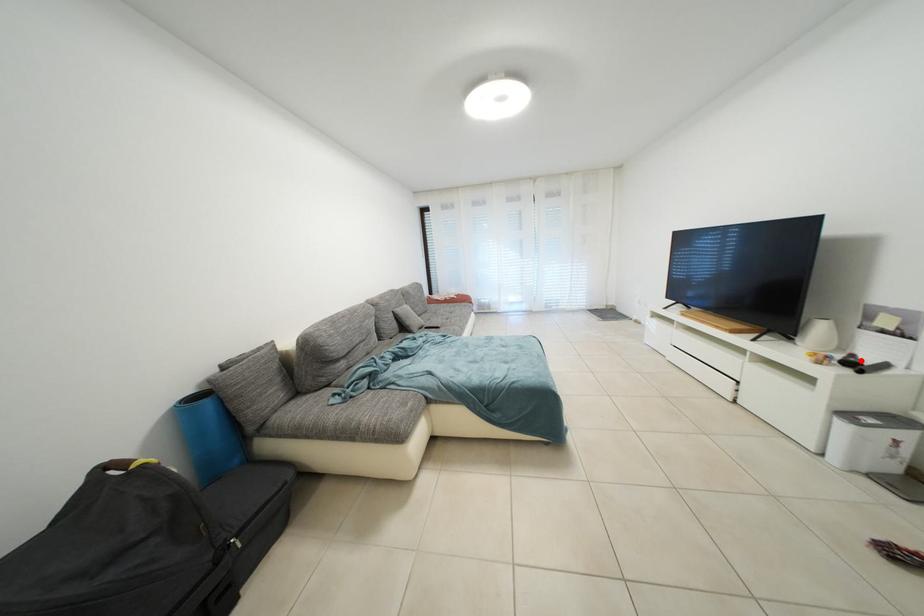
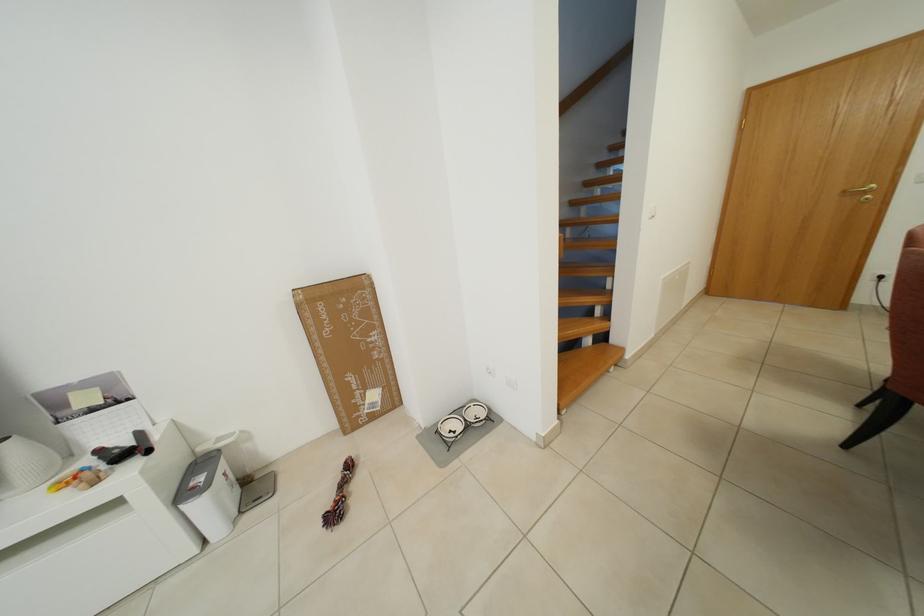
Question: I am providing you with two images of the same scene from different viewpoints. Given a red point in image1, look at the same physical point in image2. Is it:

Choices:
 (A) Closer to the viewpoint
 (B) Farther from the viewpoint

Answer: (B)